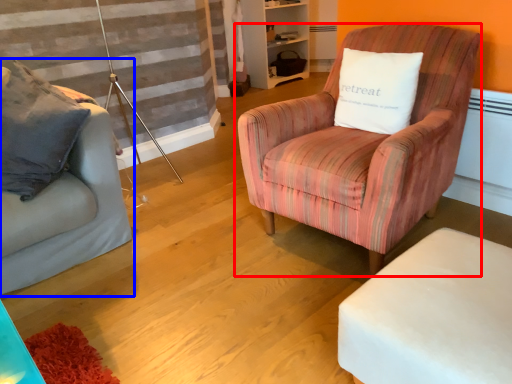
Question: Which of the following is the farthest to the observer, chair (highlighted by a red box) or studio couch (highlighted by a blue box)?

Choices:
 (A) chair
 (B) studio couch

Answer: (B)